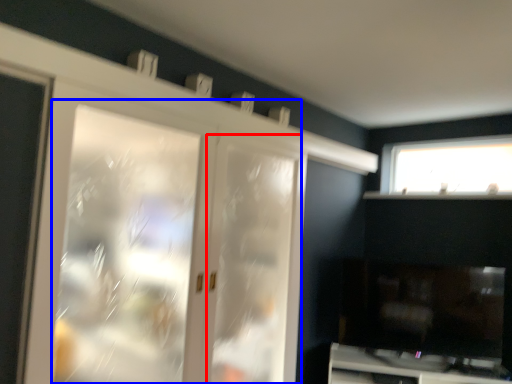
Question: Which object appears farthest to the camera in this image, screen door (highlighted by a red box) or screen door (highlighted by a blue box)?

Choices:
 (A) screen door
 (B) screen door

Answer: (A)